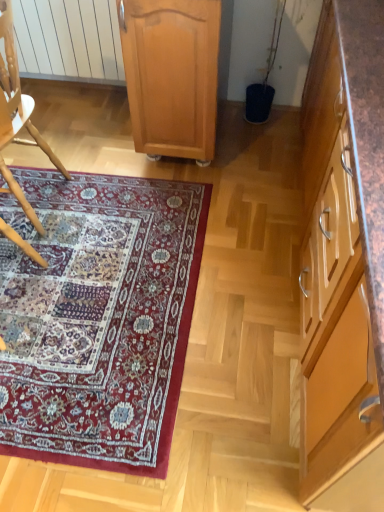
The width and height of the screenshot is (384, 512). I want to click on empty space that is to the right of wooden chair at left, so click(102, 208).